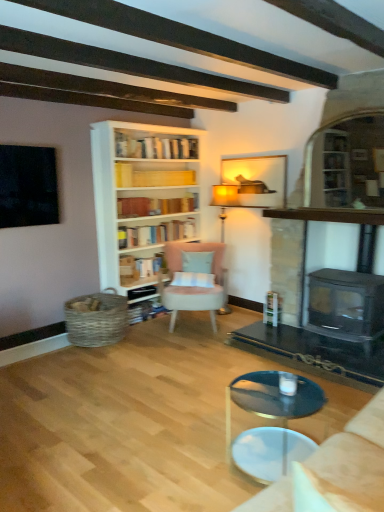
What are the coordinates of `free space above clear glass coffee table at center (from a real-world perspective)` in the screenshot? It's located at (265, 389).